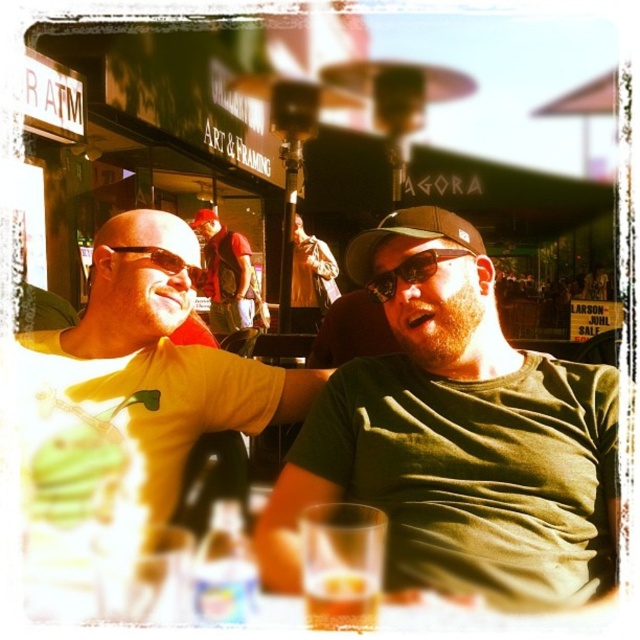
Between yellow matte t-shirt at left and translucent glass at lower center, which one appears on the right side from the viewer's perspective?

From the viewer's perspective, translucent glass at lower center appears more on the right side.

Can you confirm if yellow matte t-shirt at left is taller than translucent glass at lower center?

Indeed, yellow matte t-shirt at left has a greater height compared to translucent glass at lower center.

Does point (90, 380) lie behind point (326, 593)?

Yes, point (90, 380) is behind point (326, 593).

Identify the location of yellow matte t-shirt at left. The height and width of the screenshot is (640, 640). (141, 384).

Between yellow matte t-shirt at left and red shirt at center, which one is positioned lower?

yellow matte t-shirt at left is below.

Between point (243, 396) and point (220, 326), which one is positioned behind?

The point (220, 326) is more distant.

Is point (61, 490) positioned in front of point (218, 241)?

Yes, it is in front of point (218, 241).

Find the location of a particular element. Image resolution: width=640 pixels, height=640 pixels. yellow matte t-shirt at left is located at coordinates (141, 384).

Is red shirt at center to the left of translucent glass at lower center from the viewer's perspective?

Correct, you'll find red shirt at center to the left of translucent glass at lower center.

Between red shirt at center and translucent glass at lower center, which one has less height?

With less height is translucent glass at lower center.

Is point (216, 332) farther from camera compared to point (332, 570)?

Yes, it is behind point (332, 570).

Where is `red shirt at center`? red shirt at center is located at coordinates (227, 275).